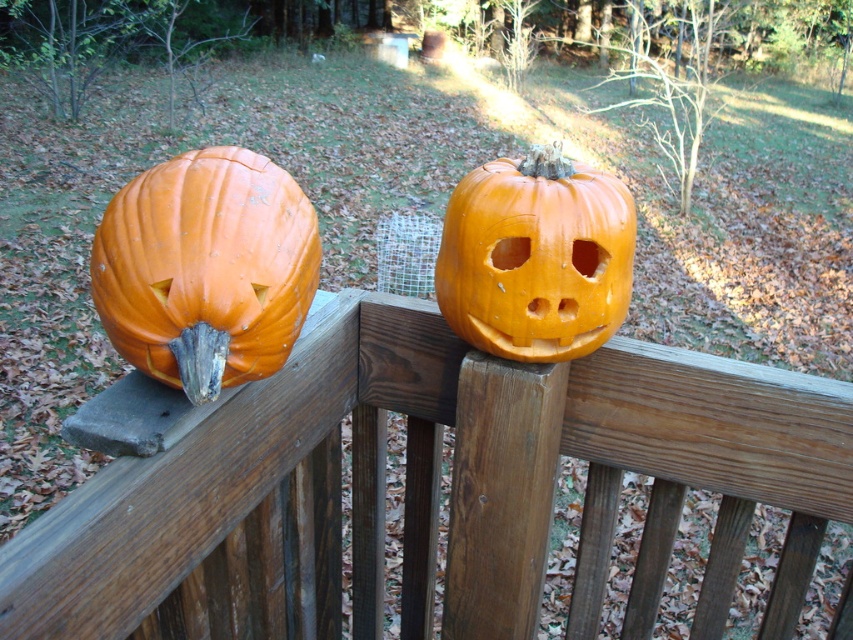
Can you confirm if orange matte pumpkin at left is positioned to the left of orange matte pumpkin at center?

Indeed, orange matte pumpkin at left is positioned on the left side of orange matte pumpkin at center.

Which is more to the left, orange matte pumpkin at left or orange matte pumpkin at center?

From the viewer's perspective, orange matte pumpkin at left appears more on the left side.

Is point (235, 180) behind point (554, 211)?

That is False.

Where is `orange matte pumpkin at left`? Image resolution: width=853 pixels, height=640 pixels. orange matte pumpkin at left is located at coordinates (206, 268).

Between wooden fence at upper center and orange matte pumpkin at center, which one is positioned higher?

orange matte pumpkin at center is higher up.

Who is more distant from viewer, (485, 515) or (548, 177)?

Positioned behind is point (485, 515).

The image size is (853, 640). Identify the location of wooden fence at upper center. (426, 488).

Image resolution: width=853 pixels, height=640 pixels. What are the coordinates of `wooden fence at upper center` in the screenshot? It's located at (426, 488).

Can you confirm if wooden fence at upper center is shorter than orange matte pumpkin at left?

No.

What do you see at coordinates (426, 488) in the screenshot? I see `wooden fence at upper center` at bounding box center [426, 488].

The height and width of the screenshot is (640, 853). What are the coordinates of `wooden fence at upper center` in the screenshot? It's located at (426, 488).